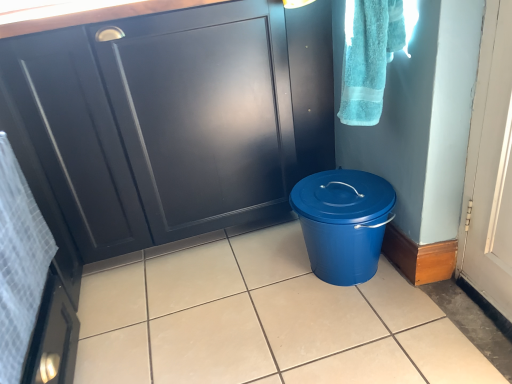
I want to click on vacant area on top of matte blue bucket at center (from a real-world perspective), so click(x=232, y=295).